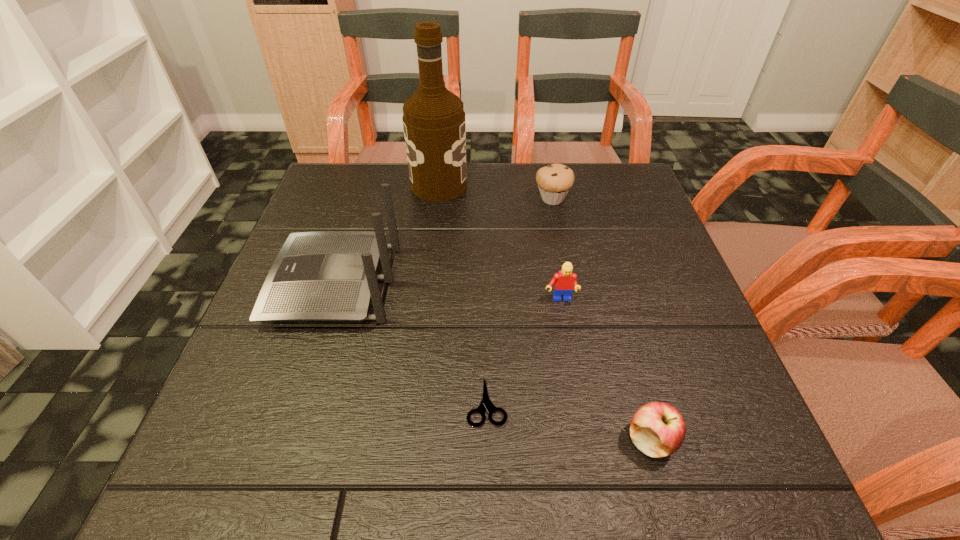
Locate an element on the screen. vacant space at the right edge of the desktop is located at coordinates (655, 225).

In the image, there is a desktop. Where is `vacant space at the far left corner`? Image resolution: width=960 pixels, height=540 pixels. vacant space at the far left corner is located at coordinates (369, 179).

You are a GUI agent. You are given a task and a screenshot of the screen. Output one action in this format:
    pyautogui.click(x=<x>, y=<y>)
    Task: Click on the free point at the far right corner
    This screenshot has height=540, width=960.
    Given the screenshot: What is the action you would take?
    pyautogui.click(x=604, y=172)

In the image, there is a desktop. Find the location of `vacant space at the near right corner`. vacant space at the near right corner is located at coordinates (694, 494).

Image resolution: width=960 pixels, height=540 pixels. Identify the location of vacant space that's between the Lego and the muffin. (556, 249).

At what (x,y) coordinates should I click in order to perform the action: click on vacant area between the tallest object and the Lego. Please return your answer as a coordinate pair (x, y). Looking at the image, I should click on (499, 243).

Identify the location of free spot between the tallest object and the muffin. (495, 192).

The height and width of the screenshot is (540, 960). I want to click on free spot between the apple and the fifth shortest object, so click(x=492, y=362).

The width and height of the screenshot is (960, 540). In order to click on free spot between the apple and the third object from left to right in this screenshot , I will do `click(568, 421)`.

Where is `free space between the Lego and the alcohol`? This screenshot has height=540, width=960. free space between the Lego and the alcohol is located at coordinates (499, 243).